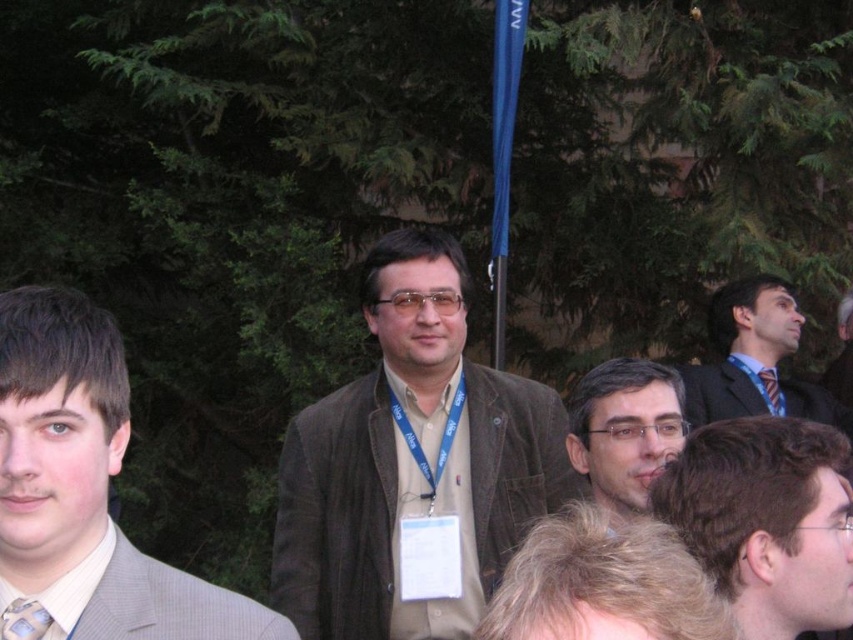
You are a photographer at the event and want to focus on the dark blue suit at center and light blue silk tie at center. Which one is closer to the camera?

The dark blue suit at center is closer to the camera than the light blue silk tie at center.

You are a photographer at the event and need to capture a clear shot of both the brown suede jacket at center and the matte black suit at right. Can you adjust your position so that neither of them blocks the other in the photo?

The brown suede jacket at center is in front of the matte black suit at right, so you can move to the side to ensure both are visible without one blocking the other.